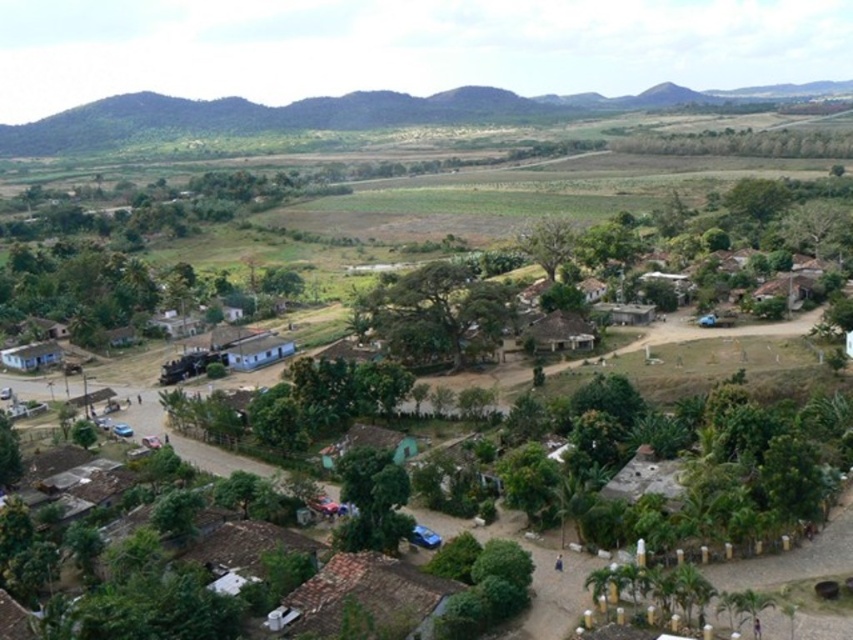
Between brown thatched roof hut at center and white matte hut at lower left, which one appears on the left side from the viewer's perspective?

From the viewer's perspective, white matte hut at lower left appears more on the left side.

Is brown thatched roof hut at center thinner than white matte hut at lower left?

Yes.

Is point (532, 336) farther from camera compared to point (56, 349)?

No, it is in front of (56, 349).

The width and height of the screenshot is (853, 640). I want to click on brown thatched roof hut at center, so click(x=558, y=333).

Is brown tiled roof at lower center closer to the viewer compared to brown corrugated metal hut at center?

Yes, brown tiled roof at lower center is closer to the viewer.

Is brown tiled roof at lower center taller than brown corrugated metal hut at center?

Yes, brown tiled roof at lower center is taller than brown corrugated metal hut at center.

Where is `brown tiled roof at lower center`? The width and height of the screenshot is (853, 640). brown tiled roof at lower center is located at coordinates (367, 596).

Does white matte hut at center appear on the right side of white matte hut at lower left?

Yes, white matte hut at center is to the right of white matte hut at lower left.

Which of these two, white matte hut at center or white matte hut at lower left, stands taller?

white matte hut at center is taller.

At what (x,y) coordinates should I click in order to perform the action: click on white matte hut at center. Please return your answer as a coordinate pair (x, y). Looking at the image, I should click on (256, 349).

At what (x,y) coordinates should I click in order to perform the action: click on white matte hut at center. Please return your answer as a coordinate pair (x, y). This screenshot has width=853, height=640. Looking at the image, I should click on (256, 349).